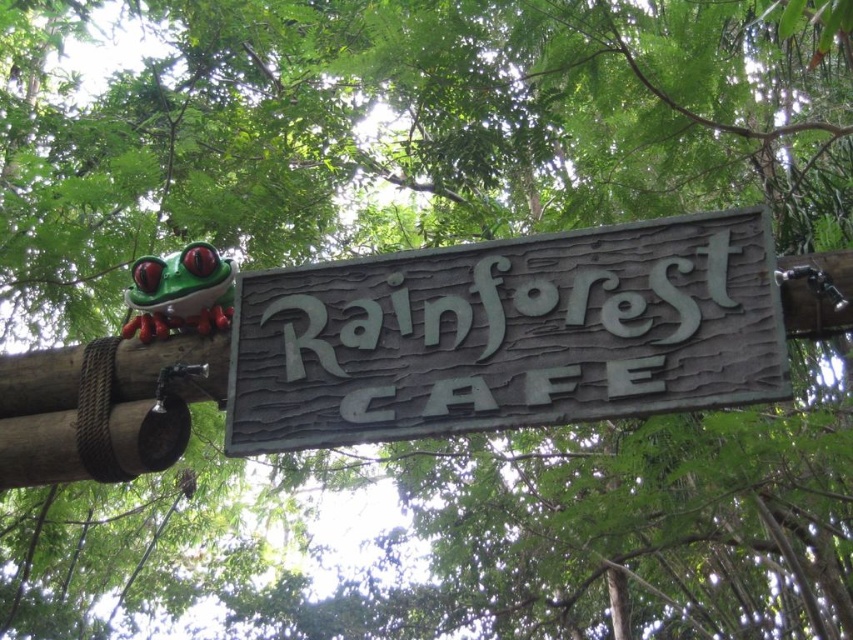
Between green wood sign at center and green matte/frosted glass frog at upper left, which one has more height?

green wood sign at center is taller.

Does green wood sign at center appear on the left side of green matte/frosted glass frog at upper left?

In fact, green wood sign at center is to the right of green matte/frosted glass frog at upper left.

Is point (637, 371) farther from camera compared to point (138, 330)?

That is False.

I want to click on green wood sign at center, so click(x=508, y=333).